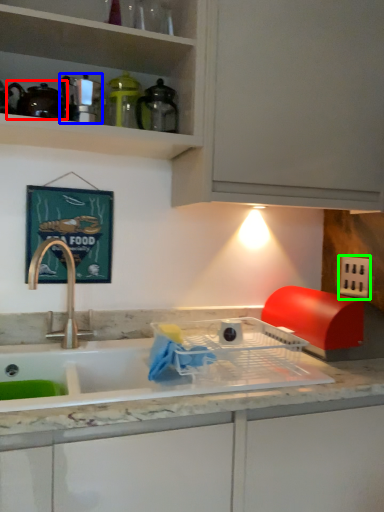
Question: Considering the real-world distances, which object is farthest from tea pot (highlighted by a red box)? appliance (highlighted by a blue box) or electric outlet (highlighted by a green box)?

Choices:
 (A) appliance
 (B) electric outlet

Answer: (B)